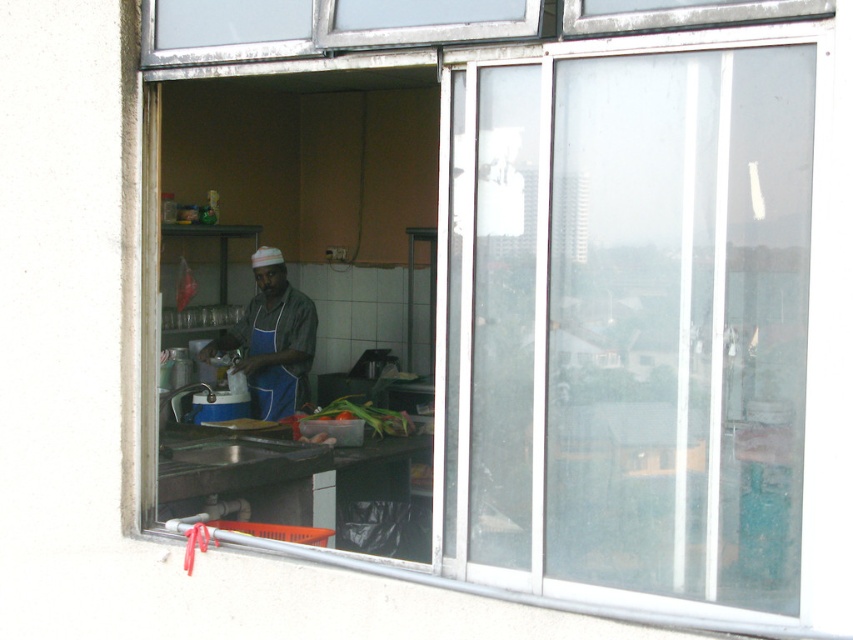
You are a chef trying to organize your counter. You have a blue fabric apron at center and a translucent plastic container at center. Which item takes up more horizontal space on the counter?

The translucent plastic container at center takes up more horizontal space on the counter because the blue fabric apron at center has a lesser width compared to it.

You are standing in front of the window and looking at the two points on the counter inside the kitchen. Which point is closer to you, point [289,308] or point [270,397]?

Point [270,397] is closer to you because it is less further to the camera than point [289,308].

You are looking through the window into the kitchen. Where is the blue apron at center located in terms of its 2D coordinates?

The blue apron at center is located at the 2D coordinates point (271, 339).